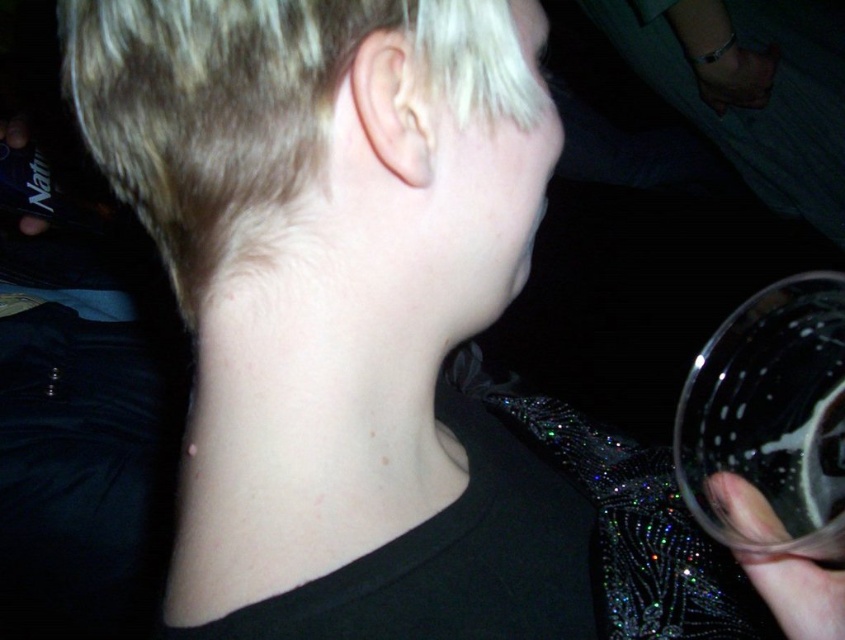
You are a bartender preparing drinks for a party. You need to choose between the transparent plastic cup at lower right and the translucent glass at right to serve a carbonated drink. Which one should you choose and why?

You should choose the transparent plastic cup at lower right because it is much taller than the translucent glass at right, allowing more space for the carbonated drink to fizz and preventing overflow.

You are a bartender preparing drinks for a customer. You have a transparent plastic cup at lower right and a translucent glass at right in front of you. Which one has a larger width?

The transparent plastic cup at lower right has a larger width than the translucent glass at right according to the description.

You are a photographer adjusting the focus of your camera. You have two points in the image you need to focus on, point 1 at point (742, 400) and point 2 at point (744, 529). Which point is closer to the camera lens and requires less adjustment to bring into focus?

Point 1 at point (742, 400) is closer to the camera lens and requires less adjustment to bring into focus because it is further to the viewer than point 2 at point (744, 529).